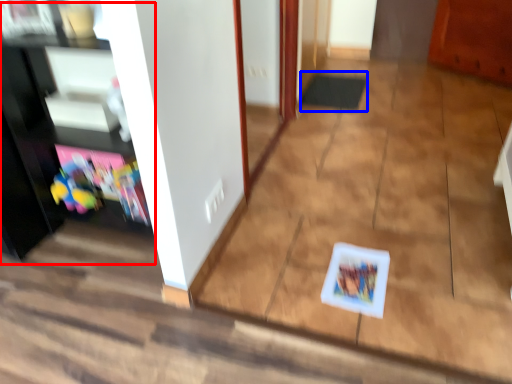
Question: Which object appears farthest to the camera in this image, entertainment center (highlighted by a red box) or doormat (highlighted by a blue box)?

Choices:
 (A) entertainment center
 (B) doormat

Answer: (B)